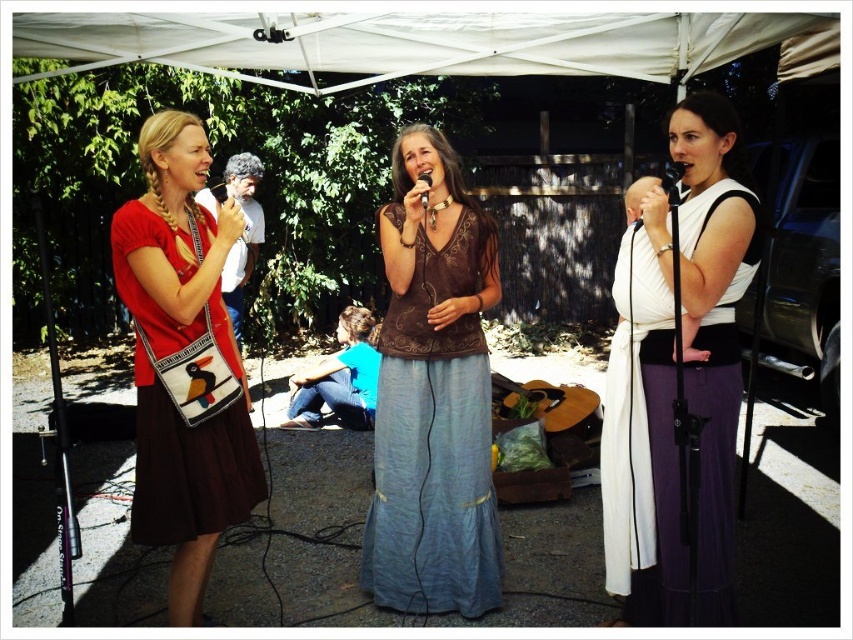
Which of these two, white silk dress at center or black matte microphone at center, stands shorter?

black matte microphone at center

Find the location of `white silk dress at center`. white silk dress at center is located at coordinates (643, 429).

I want to click on white silk dress at center, so click(x=643, y=429).

Can you confirm if white fabric canopy at upper center is bigger than wooden acoustic guitar at center?

Yes, white fabric canopy at upper center is bigger than wooden acoustic guitar at center.

Is white fabric canopy at upper center closer to the viewer compared to wooden acoustic guitar at center?

Yes, it is in front of wooden acoustic guitar at center.

What are the coordinates of `white fabric canopy at upper center` in the screenshot? It's located at (428, 44).

Image resolution: width=853 pixels, height=640 pixels. Find the location of `white fabric canopy at upper center`. white fabric canopy at upper center is located at coordinates (428, 44).

Who is higher up, white fabric canopy at upper center or matte brown purse at left?

white fabric canopy at upper center is higher up.

The width and height of the screenshot is (853, 640). What do you see at coordinates (428, 44) in the screenshot?
I see `white fabric canopy at upper center` at bounding box center [428, 44].

Who is more forward, (x=440, y=68) or (x=190, y=572)?

Point (x=190, y=572)

This screenshot has height=640, width=853. I want to click on white fabric canopy at upper center, so click(428, 44).